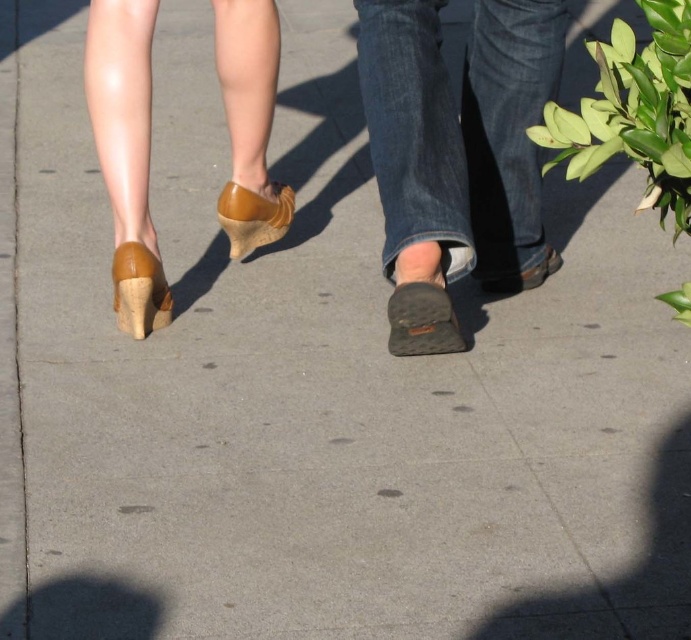
Between leather shoe at center and leather slip-on shoe at center, which one appears on the right side from the viewer's perspective?

Positioned to the right is leather slip-on shoe at center.

Is point (404, 316) positioned in front of point (539, 278)?

Yes, it is.

The image size is (691, 640). I want to click on leather shoe at center, so click(422, 321).

Between dark brown suede shoe at center and matte brown sandal at center, which one is positioned lower?

matte brown sandal at center is lower down.

What do you see at coordinates (455, 154) in the screenshot?
I see `dark brown suede shoe at center` at bounding box center [455, 154].

Locate an element on the screen. dark brown suede shoe at center is located at coordinates (455, 154).

Does point (426, 42) come in front of point (144, 252)?

Yes, it is.

Can you confirm if dark brown suede shoe at center is thinner than matte brown wedge at lower left?

No, dark brown suede shoe at center is not thinner than matte brown wedge at lower left.

The image size is (691, 640). In order to click on dark brown suede shoe at center in this screenshot , I will do `click(455, 154)`.